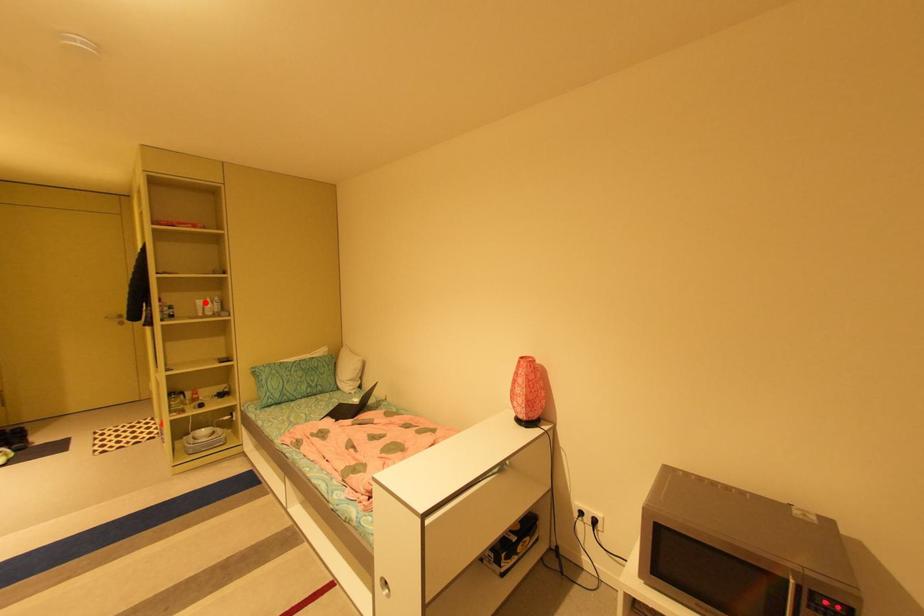
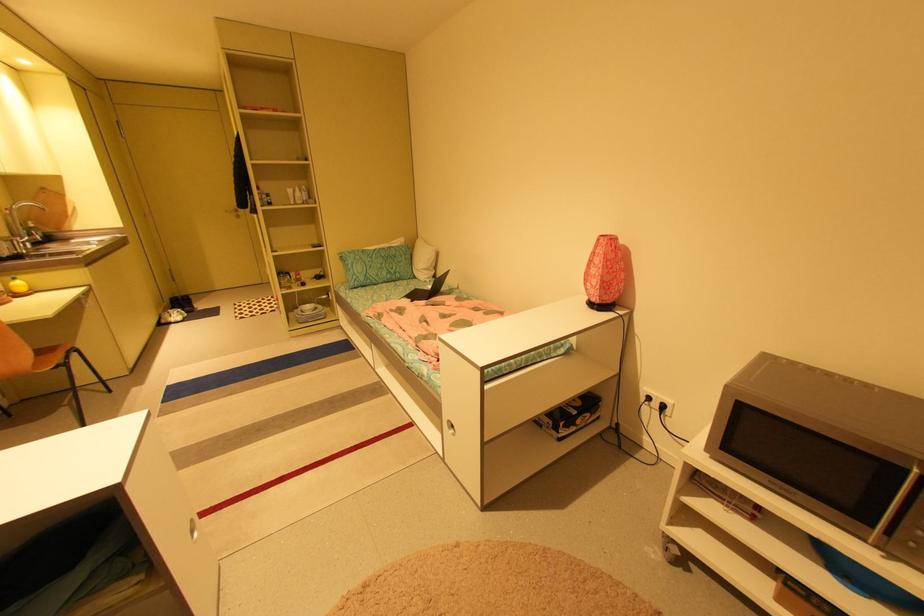
The point at the highlighted location is marked in the first image. Where is the corresponding point in the second image?

(296, 191)